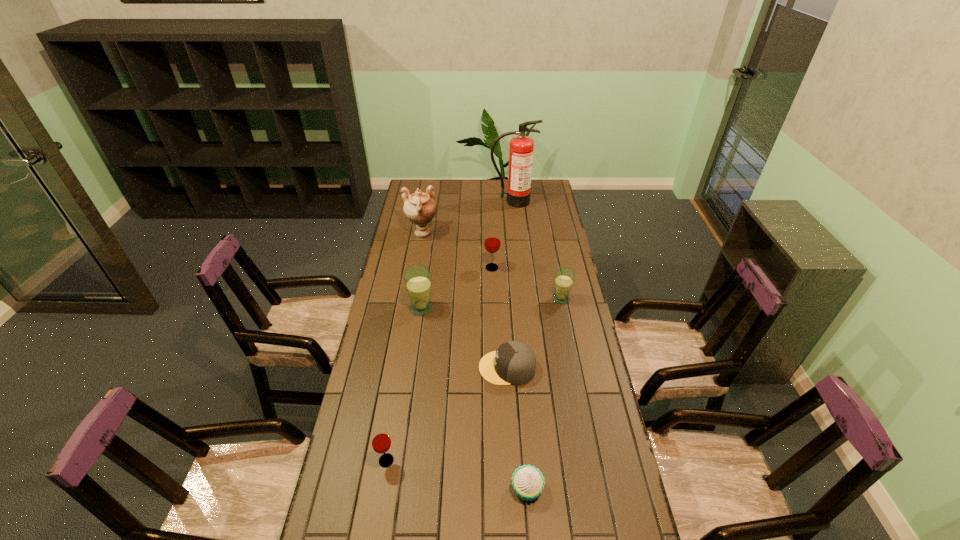
Identify the location of red fire extinguisher. (521, 148).

Where is `fire extinguisher`? The height and width of the screenshot is (540, 960). fire extinguisher is located at coordinates (521, 148).

Identify the location of the seventh shortest object. The width and height of the screenshot is (960, 540). (420, 208).

Locate an element on the screen. the second farthest object is located at coordinates (420, 208).

The width and height of the screenshot is (960, 540). What are the coordinates of `the bigger blue glass` in the screenshot? It's located at point(418,279).

The width and height of the screenshot is (960, 540). I want to click on the bigger red glass, so (492, 242).

Identify the location of the farthest glass. Image resolution: width=960 pixels, height=540 pixels. (492, 242).

You are a GUI agent. You are given a task and a screenshot of the screen. Output one action in this format:
    pyautogui.click(x=<x>, y=<y>)
    Task: Click on the rightmost glass
    This screenshot has width=960, height=540.
    Given the screenshot: What is the action you would take?
    pyautogui.click(x=564, y=277)

Where is `the smaller blue glass`? the smaller blue glass is located at coordinates (564, 277).

Find the location of a particular element. the nearest glass is located at coordinates (381, 442).